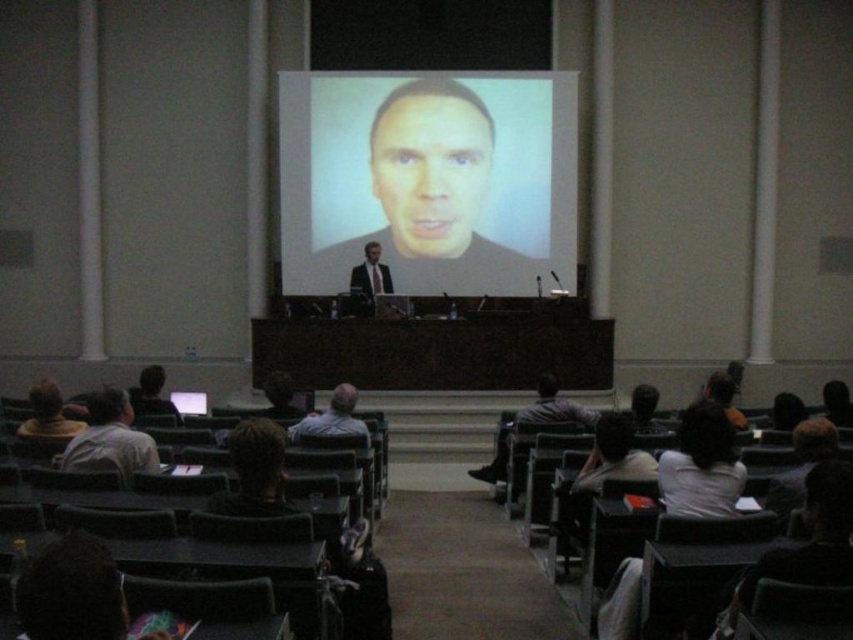
Question: Does matte screen at center have a greater width compared to matte black suit at center?

Choices:
 (A) no
 (B) yes

Answer: (B)

Question: Observing the image, what is the correct spatial positioning of dark brown hair at lower left in reference to matte black face at center?

Choices:
 (A) left
 (B) right

Answer: (A)

Question: Which object is farther from the camera taking this photo?

Choices:
 (A) gray hair at center
 (B) smooth skin face at center
 (C) matte black suit at center

Answer: (B)

Question: Can you confirm if matte screen at center is smaller than dark brown hair at lower left?

Choices:
 (A) yes
 (B) no

Answer: (B)

Question: Which object is farther from the camera taking this photo?

Choices:
 (A) smooth skin face at center
 (B) matte black face at center
 (C) gray hair at center
 (D) dark gray shirt at lower center

Answer: (A)

Question: Considering the real-world distances, which object is farthest from the matte black suit at center?

Choices:
 (A) dark brown hair at lower left
 (B) light gray shirt at lower left

Answer: (B)